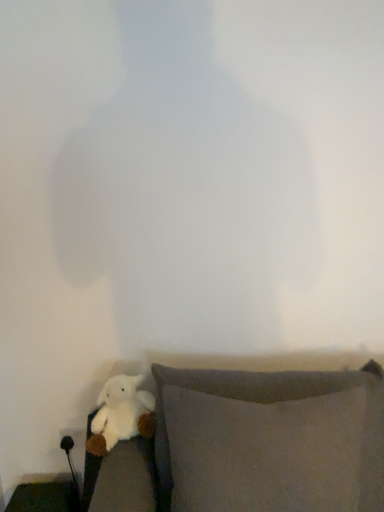
Question: In the image, is gray fabric pillow at lower right, acting as the second furniture starting from the back, positioned in front of or behind white plush toy at lower left?

Choices:
 (A) front
 (B) behind

Answer: (A)

Question: From the image's perspective, is gray fabric pillow at lower right, which is counted as the 1th furniture, starting from the front, located above or below white plush toy at lower left?

Choices:
 (A) above
 (B) below

Answer: (B)

Question: Which is farther from the white plush toy at lower left?

Choices:
 (A) matte black side table at lower left, positioned as the first furniture in bottom-to-top order
 (B) gray fabric pillow at lower right, the 1th furniture when ordered from right to left

Answer: (A)

Question: Estimate the real-world distances between objects in this image. Which object is farther from the gray fabric pillow at lower right, acting as the second furniture starting from the back?

Choices:
 (A) matte black side table at lower left, positioned as the second furniture in front-to-back order
 (B) white plush toy at lower left

Answer: (A)